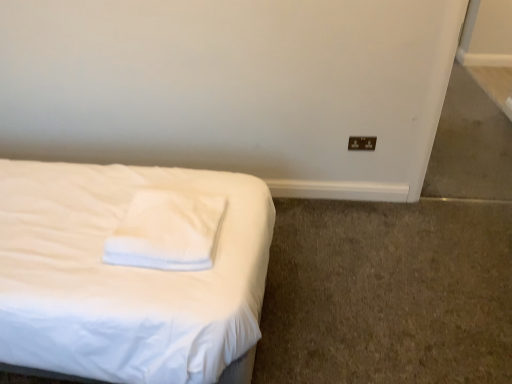
Describe the element at coordinates (167, 231) in the screenshot. This screenshot has height=384, width=512. I see `white soft pillow at center` at that location.

This screenshot has width=512, height=384. I want to click on white soft pillow at center, so click(x=167, y=231).

The width and height of the screenshot is (512, 384). What do you see at coordinates (362, 143) in the screenshot? I see `black plastic electric outlet at upper right` at bounding box center [362, 143].

In order to face black plastic electric outlet at upper right, should I rotate leftwards or rightwards?

Turn right approximately 14.142 degrees to face it.

At what (x,y) coordinates should I click in order to perform the action: click on black plastic electric outlet at upper right. Please return your answer as a coordinate pair (x, y). This screenshot has height=384, width=512. Looking at the image, I should click on (362, 143).

Image resolution: width=512 pixels, height=384 pixels. I want to click on white soft pillow at center, so click(167, 231).

In the image, is black plastic electric outlet at upper right on the left side or the right side of white soft pillow at center?

Based on their positions, black plastic electric outlet at upper right is located to the right of white soft pillow at center.

Is black plastic electric outlet at upper right behind white soft pillow at center?

Yes.

Is point (368, 149) closer or farther from the camera than point (196, 228)?

Point (368, 149) is positioned farther from the camera compared to point (196, 228).

From the image's perspective, which is above, black plastic electric outlet at upper right or white soft pillow at center?

From the image's view, black plastic electric outlet at upper right is above.

From a real-world perspective, does black plastic electric outlet at upper right sit lower than white soft pillow at center?

Yes.

Is black plastic electric outlet at upper right thinner than white soft pillow at center?

Yes, black plastic electric outlet at upper right is thinner than white soft pillow at center.

Is black plastic electric outlet at upper right taller than white soft pillow at center?

Indeed, black plastic electric outlet at upper right has a greater height compared to white soft pillow at center.

In the scene shown: Can you confirm if black plastic electric outlet at upper right is bigger than white soft pillow at center?

No.

Is black plastic electric outlet at upper right surrounding white soft pillow at center?

No.

Are black plastic electric outlet at upper right and white soft pillow at center located far from each other?

Absolutely, black plastic electric outlet at upper right is distant from white soft pillow at center.

Is white soft pillow at center at the back of black plastic electric outlet at upper right?

No.

How many degrees apart are the facing directions of black plastic electric outlet at upper right and white soft pillow at center?

The angular difference between black plastic electric outlet at upper right and white soft pillow at center is 86.8 degrees.

How far apart are black plastic electric outlet at upper right and white soft pillow at center?

black plastic electric outlet at upper right is 1.28 meters from white soft pillow at center.

Where is `electric outlet that is above the white soft pillow at center (from the image's perspective)`? The width and height of the screenshot is (512, 384). electric outlet that is above the white soft pillow at center (from the image's perspective) is located at coordinates (362, 143).

Considering the positions of objects white soft pillow at center and black plastic electric outlet at upper right in the image provided, who is more to the right, white soft pillow at center or black plastic electric outlet at upper right?

→ black plastic electric outlet at upper right.

Is white soft pillow at center positioned behind black plastic electric outlet at upper right?

No, white soft pillow at center is in front of black plastic electric outlet at upper right.

Is point (197, 210) more distant than point (354, 137)?

No.

From the image's perspective, which one is positioned higher, white soft pillow at center or black plastic electric outlet at upper right?

black plastic electric outlet at upper right appears higher in the image.

From a real-world perspective, does white soft pillow at center sit lower than black plastic electric outlet at upper right?

Incorrect, from a real-world perspective, white soft pillow at center is higher than black plastic electric outlet at upper right.

Looking at their sizes, would you say white soft pillow at center is wider or thinner than black plastic electric outlet at upper right?

Clearly, white soft pillow at center has more width compared to black plastic electric outlet at upper right.

In the scene shown: Considering the sizes of white soft pillow at center and black plastic electric outlet at upper right in the image, is white soft pillow at center taller or shorter than black plastic electric outlet at upper right?

Clearly, white soft pillow at center is shorter compared to black plastic electric outlet at upper right.

Does white soft pillow at center have a smaller size compared to black plastic electric outlet at upper right?

Incorrect, white soft pillow at center is not smaller in size than black plastic electric outlet at upper right.

Would you say white soft pillow at center contains black plastic electric outlet at upper right?

That's incorrect, black plastic electric outlet at upper right is not inside white soft pillow at center.

Is white soft pillow at center placed right next to black plastic electric outlet at upper right?

white soft pillow at center is not next to black plastic electric outlet at upper right, and they're not touching.

Is white soft pillow at center facing away from black plastic electric outlet at upper right?

white soft pillow at center does not have its back to black plastic electric outlet at upper right.

How many degrees apart are the facing directions of white soft pillow at center and black plastic electric outlet at upper right?

white soft pillow at center and black plastic electric outlet at upper right are facing 86.8 degrees away from each other.

At what (x,y) coordinates should I click in order to perform the action: click on pillow lying on the left of black plastic electric outlet at upper right. Please return your answer as a coordinate pair (x, y). This screenshot has height=384, width=512. Looking at the image, I should click on [x=167, y=231].

Locate an element on the screen. The height and width of the screenshot is (384, 512). pillow located on the left of black plastic electric outlet at upper right is located at coordinates (167, 231).

Find the location of `pillow above the black plastic electric outlet at upper right (from a real-world perspective)`. pillow above the black plastic electric outlet at upper right (from a real-world perspective) is located at coordinates (167, 231).